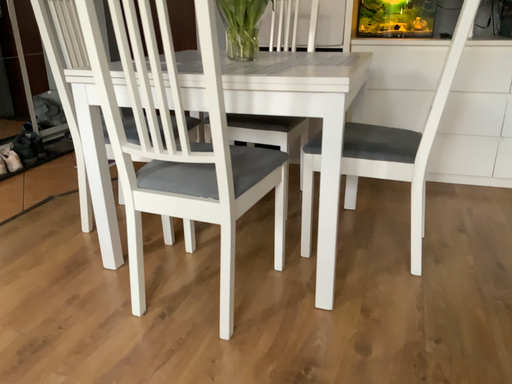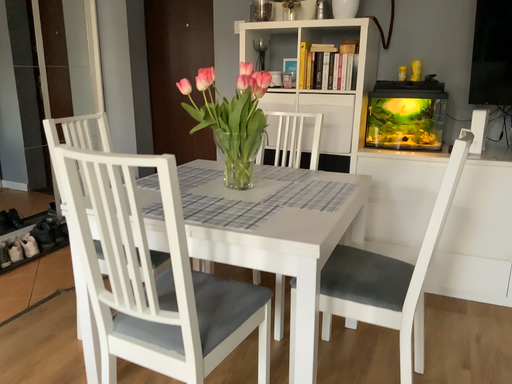
Question: How did the camera likely rotate when shooting the video?

Choices:
 (A) rotated downward
 (B) rotated upward

Answer: (B)